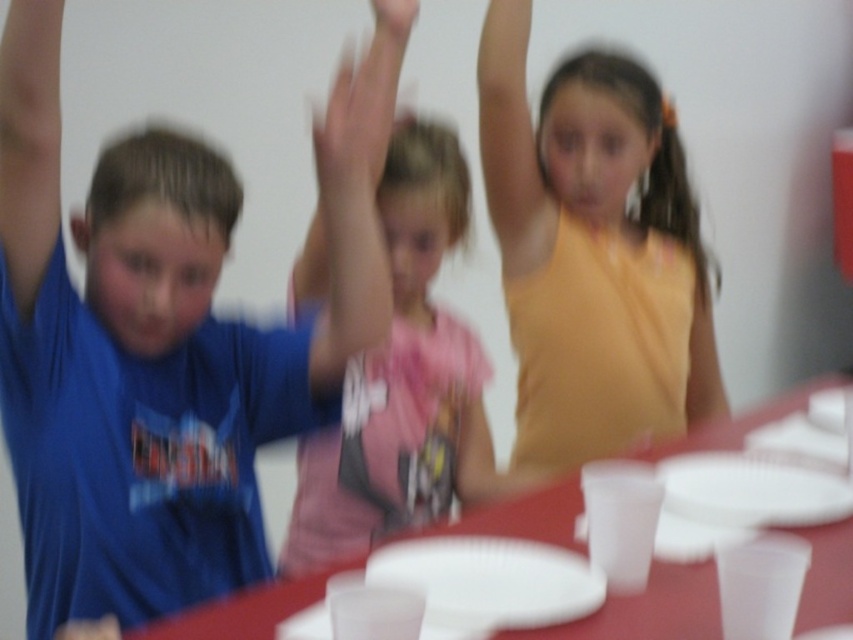
Question: In this image, where is matte yellow arm at upper right located relative to matte blue shirt at upper left?

Choices:
 (A) right
 (B) left

Answer: (A)

Question: Is white paper plate at lower right below matte blue shirt at upper left?

Choices:
 (A) yes
 (B) no

Answer: (B)

Question: Which object is closer to the camera taking this photo?

Choices:
 (A) matte yellow arm at upper center
 (B) white plastic plate at center
 (C) white paper plate at lower right
 (D) smooth skin hand at center

Answer: (B)

Question: Based on their relative distances, which object is nearer to the matte yellow arm at upper center?

Choices:
 (A) matte yellow arm at upper right
 (B) smooth plastic table at center
 (C) matte blue shirt at upper left

Answer: (A)

Question: In this image, where is blue t-shirt at left located relative to matte blue shirt at upper left?

Choices:
 (A) left
 (B) right

Answer: (A)

Question: Which point is farther to the camera?

Choices:
 (A) (796, 506)
 (B) (701, 356)

Answer: (B)